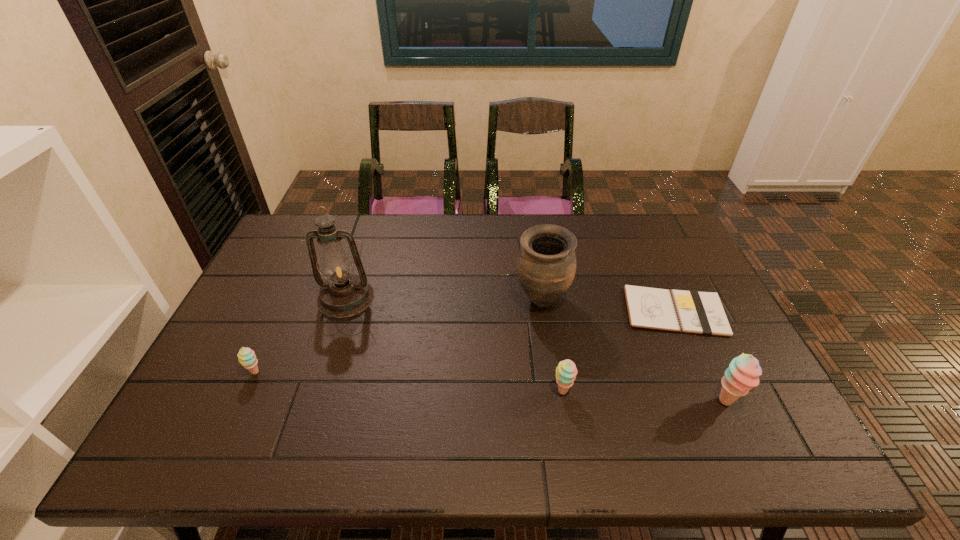
Locate an element on the screen. This screenshot has height=540, width=960. free space located 0.230m on the right of the leftmost sherbert is located at coordinates (354, 372).

Where is `vacant space located 0.380m on the back of the second sherbert from left to right`? Image resolution: width=960 pixels, height=540 pixels. vacant space located 0.380m on the back of the second sherbert from left to right is located at coordinates (544, 280).

Locate an element on the screen. The image size is (960, 540). vacant region located on the back of the fourth shortest object is located at coordinates (696, 339).

The width and height of the screenshot is (960, 540). Find the location of `blank space located 0.080m on the back of the urn`. blank space located 0.080m on the back of the urn is located at coordinates (537, 265).

What are the coordinates of `vacant area situated 0.220m on the back of the tallest object` in the screenshot? It's located at (366, 236).

This screenshot has height=540, width=960. I want to click on vacant space located 0.150m on the back of the shortest object, so click(650, 256).

Locate an element on the screen. This screenshot has height=540, width=960. object present at the left edge is located at coordinates (246, 356).

Find the location of a particular element. The width and height of the screenshot is (960, 540). sherbert at the right edge is located at coordinates (743, 373).

Identify the location of notepad located at the right edge. (698, 312).

Where is `object located in the near right corner section of the desktop`? This screenshot has height=540, width=960. object located in the near right corner section of the desktop is located at coordinates (743, 373).